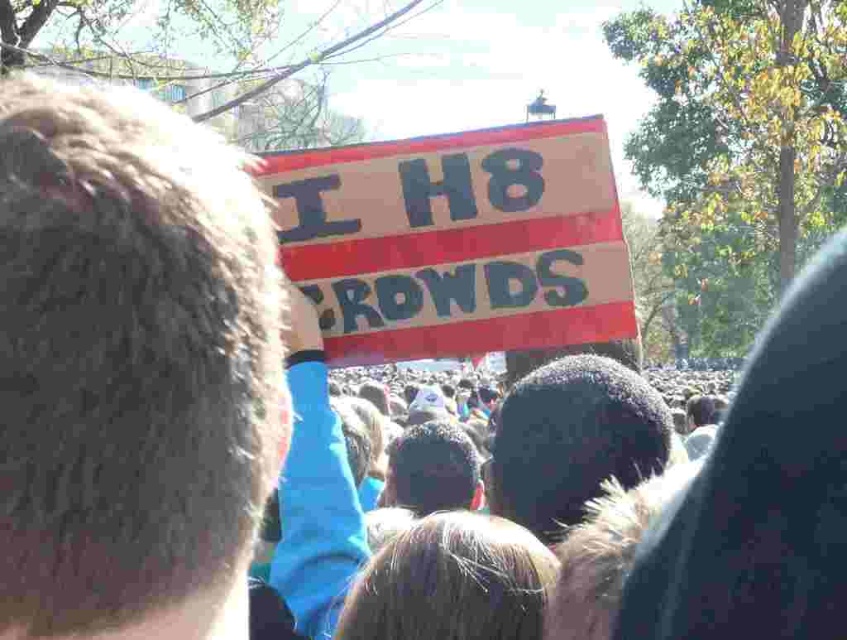
Question: Is wooden sign at center above brown fur at center?

Choices:
 (A) yes
 (B) no

Answer: (A)

Question: Can you confirm if wooden sign at center is thinner than brown fur at center?

Choices:
 (A) no
 (B) yes

Answer: (A)

Question: Is wooden sign at center to the right of brown fur at center from the viewer's perspective?

Choices:
 (A) yes
 (B) no

Answer: (B)